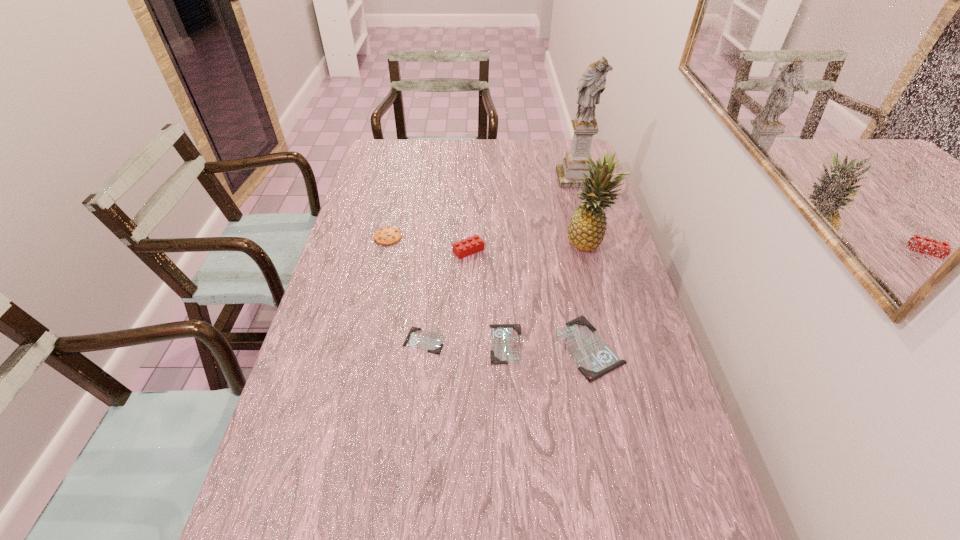
What are the coordinates of `object that is at the far edge` in the screenshot? It's located at (592, 83).

I want to click on object that is positioned at the left edge, so click(x=387, y=235).

Locate an element on the screen. This screenshot has width=960, height=540. identity card that is at the right edge is located at coordinates (595, 358).

The image size is (960, 540). What are the coordinates of `sculpture that is at the right edge` in the screenshot? It's located at [x=592, y=83].

What are the coordinates of `pineapple at the right edge` in the screenshot? It's located at (586, 230).

You are a GUI agent. You are given a task and a screenshot of the screen. Output one action in this format:
    pyautogui.click(x=<x>, y=<y>)
    Task: Click on the object that is at the far right corner
    Image resolution: width=960 pixels, height=540 pixels.
    Given the screenshot: What is the action you would take?
    pyautogui.click(x=592, y=83)

Where is `vacant space at the far edge`? The image size is (960, 540). vacant space at the far edge is located at coordinates (493, 150).

Locate an element on the screen. Image resolution: width=960 pixels, height=540 pixels. vacant area at the near edge of the desktop is located at coordinates (492, 493).

At what (x,y) coordinates should I click in order to perform the action: click on vacant space at the left edge. Please return your answer as a coordinate pair (x, y). Looking at the image, I should click on (356, 200).

You are a GUI agent. You are given a task and a screenshot of the screen. Output one action in this format:
    pyautogui.click(x=<x>, y=<y>)
    Task: Click on the blank area at the right edge
    Image resolution: width=960 pixels, height=540 pixels.
    Given the screenshot: What is the action you would take?
    click(x=617, y=298)